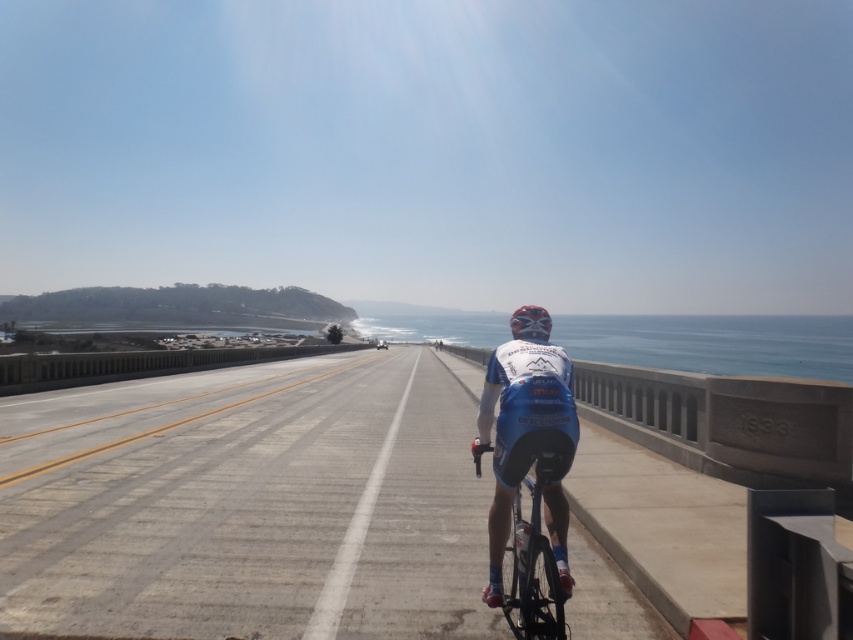
Question: Does blue fabric jersey at center appear over shiny blue frame at center?

Choices:
 (A) yes
 (B) no

Answer: (A)

Question: Which point appears closest to the camera in this image?

Choices:
 (A) (538, 358)
 (B) (524, 308)
 (C) (560, 611)

Answer: (C)

Question: Can you confirm if gray asphalt highway at center is positioned to the right of shiny blue frame at center?

Choices:
 (A) yes
 (B) no

Answer: (B)

Question: Which is nearer to the shiny red helmet at center?

Choices:
 (A) shiny blue frame at center
 (B) blue fabric jersey at center

Answer: (B)

Question: Which point is closer to the camera?

Choices:
 (A) (514, 554)
 (B) (396, 620)
 (C) (550, 529)
 (D) (546, 316)

Answer: (C)

Question: Does gray asphalt highway at center have a larger size compared to blue fabric jersey at center?

Choices:
 (A) yes
 (B) no

Answer: (A)